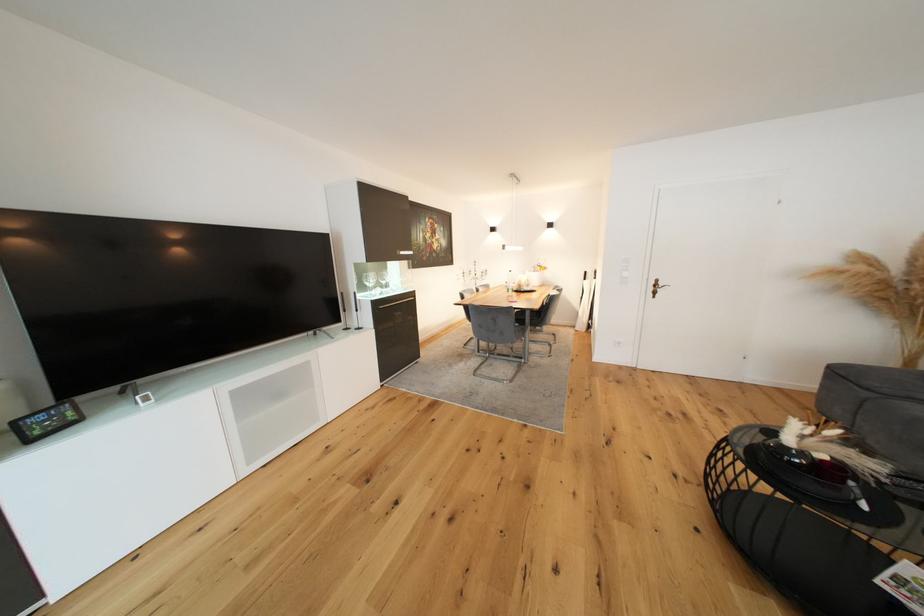
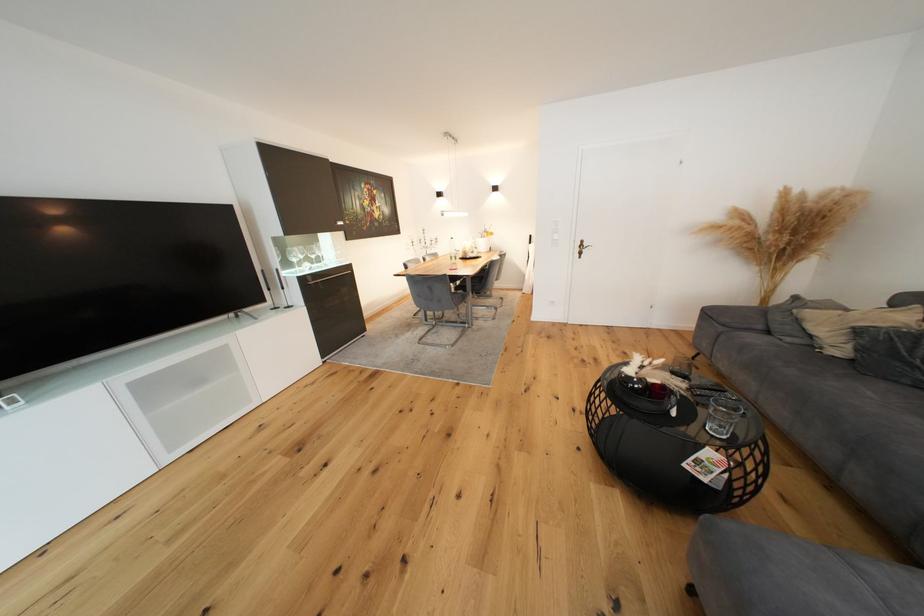
Find the pixel in the second image that matches (370,289) in the first image.

(295, 265)